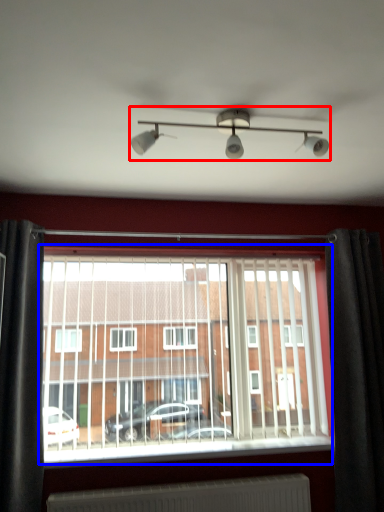
Question: Which point is further to the camera, light fixture (highlighted by a red box) or window (highlighted by a blue box)?

Choices:
 (A) light fixture
 (B) window

Answer: (B)